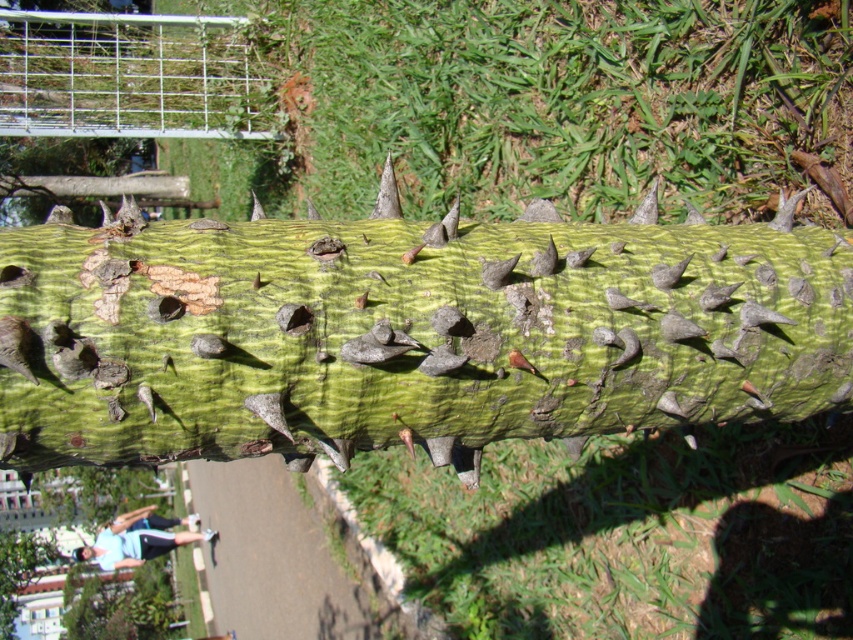
From the picture: You are a gardener who needs to place a protective cover over the green rough bark at center and the blue fabric at lower left. Which object requires a taller cover?

The blue fabric at lower left requires a taller cover because the green rough bark at center is not as tall as the blue fabric at lower left.

You are standing in a garden and see the green rough bark at center and the blue fabric at lower left. Which object is higher up from the ground?

The green rough bark at center is higher up from the ground than the blue fabric at lower left because it is positioned above it.